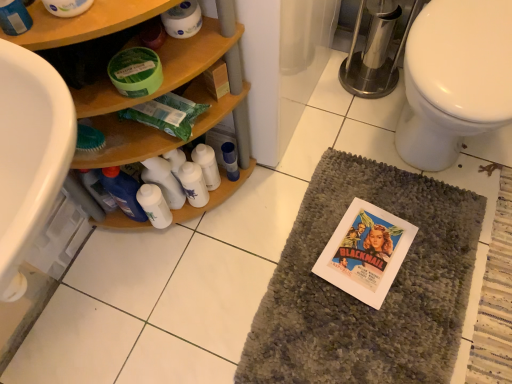
Locate an element on the screen. This screenshot has width=512, height=384. free spot to the right of white plastic bottles at center, the 2th bottle in the right-to-left sequence is located at coordinates (268, 192).